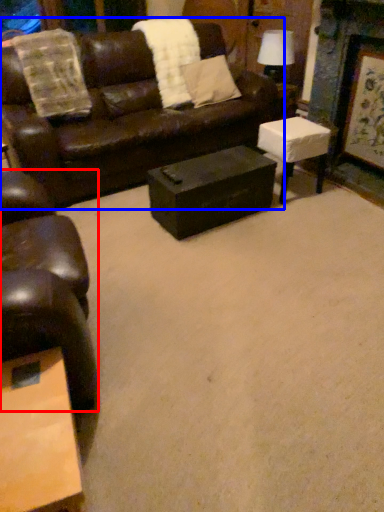
Question: Among these objects, which one is farthest to the camera, chair (highlighted by a red box) or studio couch (highlighted by a blue box)?

Choices:
 (A) chair
 (B) studio couch

Answer: (B)